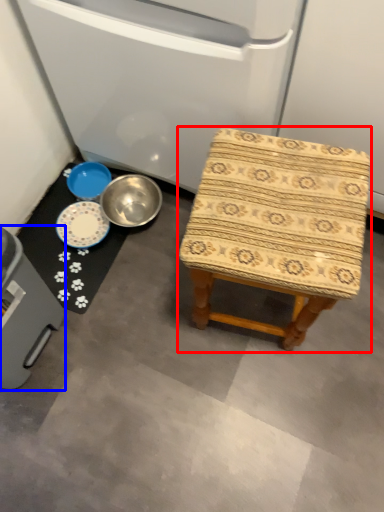
Question: Which point is closer to the camera, stool (highlighted by a red box) or appliance (highlighted by a blue box)?

Choices:
 (A) stool
 (B) appliance

Answer: (B)